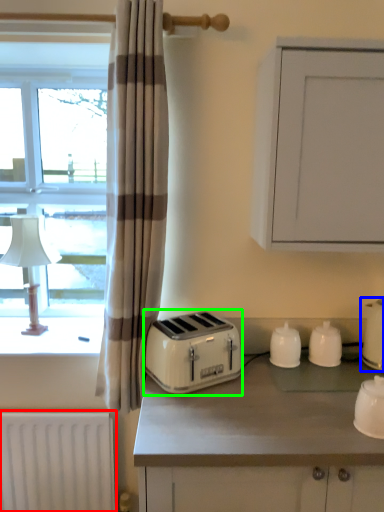
Question: Estimate the real-world distances between objects in this image. Which object is farther from radiator (highlighted by a red box), kitchen appliance (highlighted by a blue box) or toaster (highlighted by a green box)?

Choices:
 (A) kitchen appliance
 (B) toaster

Answer: (A)